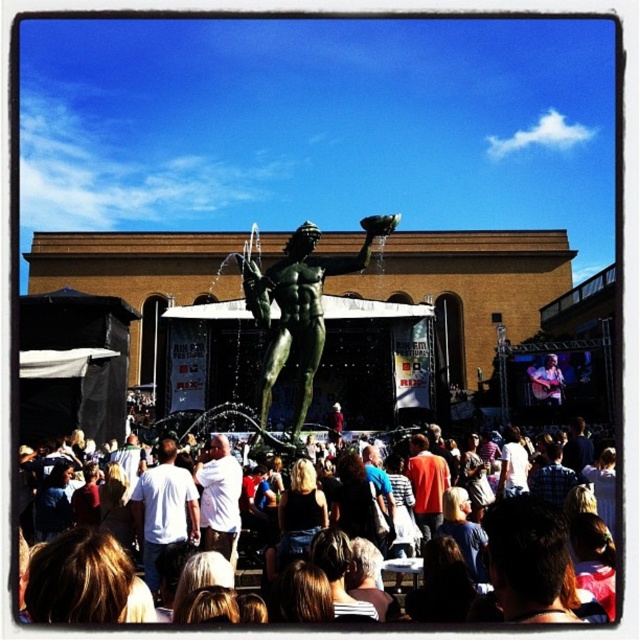
Who is lower down, multicolored fabric crowd at center or white cotton shirt at center?

multicolored fabric crowd at center is lower down.

Between multicolored fabric crowd at center and white cotton shirt at center, which one has more height?

white cotton shirt at center

Who is more forward, (452, 554) or (205, 465)?

Positioned in front is point (452, 554).

Identify the location of multicolored fabric crowd at center. (544, 564).

Can you confirm if multicolored fabric crowd at center is bigger than white matte shirt at center?

Indeed, multicolored fabric crowd at center has a larger size compared to white matte shirt at center.

Is point (513, 545) positioned after point (173, 529)?

No, it is not.

The image size is (640, 640). Identify the location of multicolored fabric crowd at center. (544, 564).

Looking at this image, can you confirm if bronze statue at center is positioned to the left of white cotton shirt at center?

In fact, bronze statue at center is to the right of white cotton shirt at center.

Which is in front, point (292, 292) or point (218, 547)?

Point (218, 547) is in front.

Image resolution: width=640 pixels, height=640 pixels. Identify the location of bronze statue at center. (300, 307).